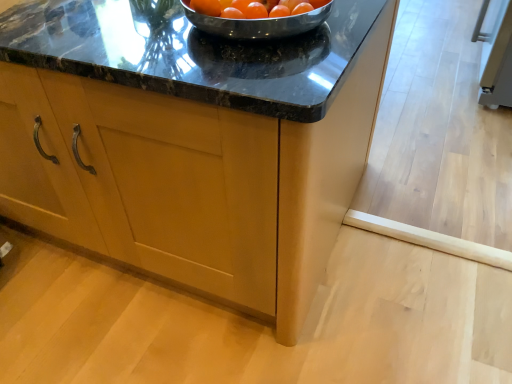
Find the location of a particular element. This screenshot has height=384, width=512. free space in front of orange matte tomato at center is located at coordinates (244, 54).